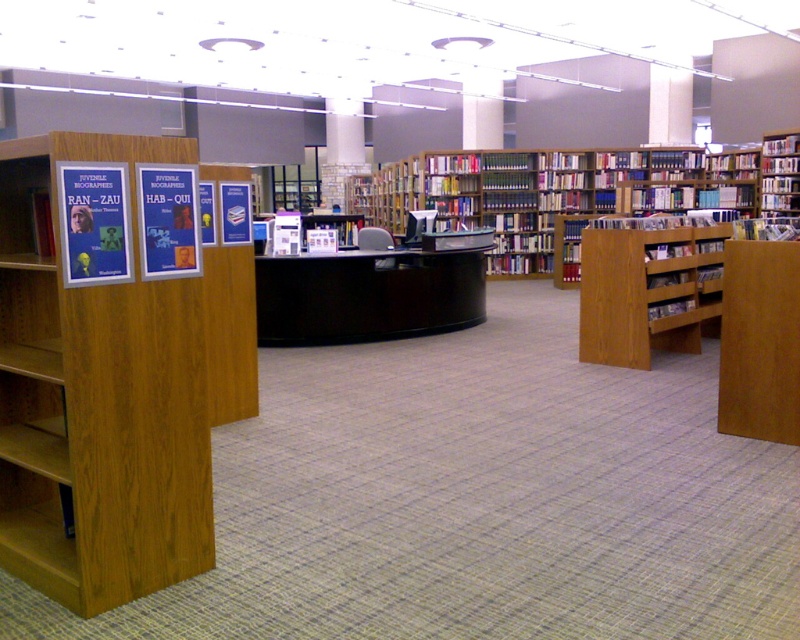
Which of these two, light brown wood bookcase at left or blue paper poster at left, stands taller?

With more height is light brown wood bookcase at left.

Who is higher up, light brown wood bookcase at left or blue paper poster at left?

blue paper poster at left is higher up.

Which is in front, point (57, 300) or point (36, 227)?

Positioned in front is point (36, 227).

Identify the location of light brown wood bookcase at left. The height and width of the screenshot is (640, 800). (112, 392).

Is the position of light brown wood bookcase at left less distant than that of wooden bookcase at center?

That is True.

Who is positioned more to the right, light brown wood bookcase at left or wooden bookcase at center?

wooden bookcase at center

Locate an element on the screen. The width and height of the screenshot is (800, 640). light brown wood bookcase at left is located at coordinates (112, 392).

Is light brown wood bookcase at left shorter than matte brown book at center?

No.

This screenshot has height=640, width=800. What do you see at coordinates (112, 392) in the screenshot?
I see `light brown wood bookcase at left` at bounding box center [112, 392].

The height and width of the screenshot is (640, 800). I want to click on light brown wood bookcase at left, so click(112, 392).